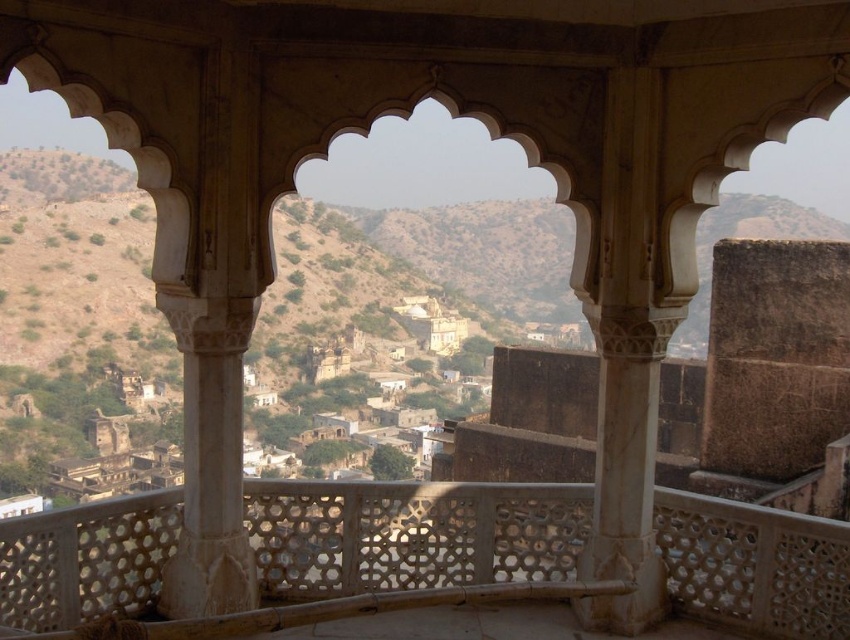
Is white carved stone balcony at center positioned behind white marble pillar at center?

No, it is in front of white marble pillar at center.

Which is above, white carved stone balcony at center or white marble pillar at center?

white marble pillar at center is higher up.

Does point (507, 532) come farther from viewer compared to point (643, 196)?

That is True.

You are a GUI agent. You are given a task and a screenshot of the screen. Output one action in this format:
    pyautogui.click(x=<x>, y=<y>)
    Task: Click on the white carved stone balcony at center
    
    Given the screenshot: What is the action you would take?
    pyautogui.click(x=411, y=534)